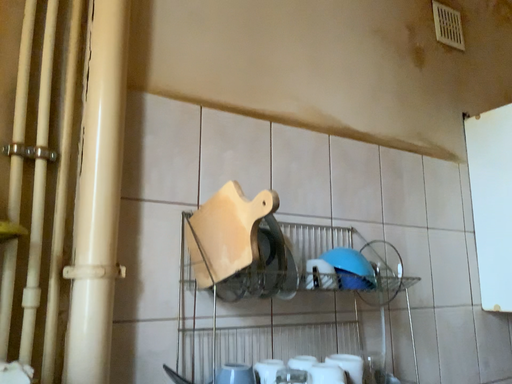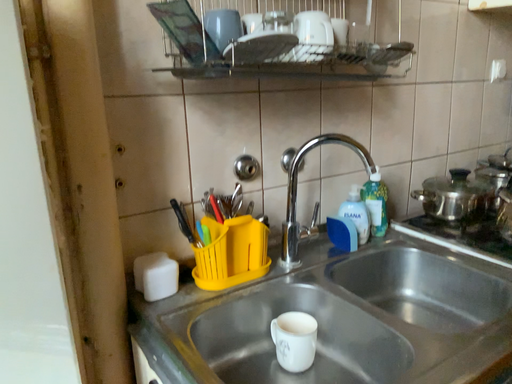
Question: Which way did the camera rotate in the video?

Choices:
 (A) rotated upward
 (B) rotated downward

Answer: (B)